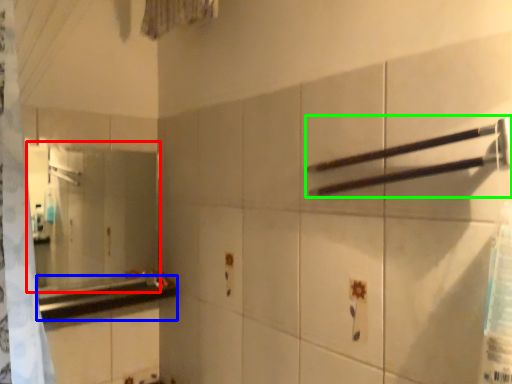
Question: Which is nearer to the mirror (highlighted by a red box)? counter top (highlighted by a blue box) or towel bar (highlighted by a green box).

Choices:
 (A) counter top
 (B) towel bar

Answer: (A)